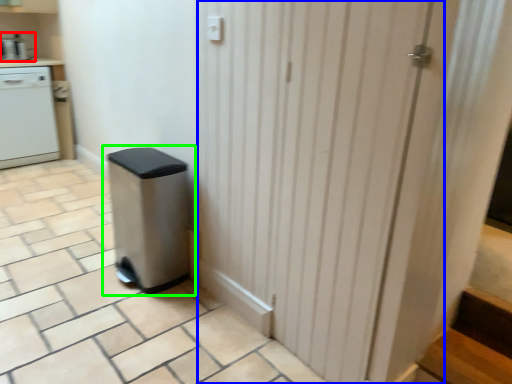
Question: Considering the real-world distances, which object is farthest from kitchen appliance (highlighted by a red box)? screen door (highlighted by a blue box) or waste container (highlighted by a green box)?

Choices:
 (A) screen door
 (B) waste container

Answer: (A)